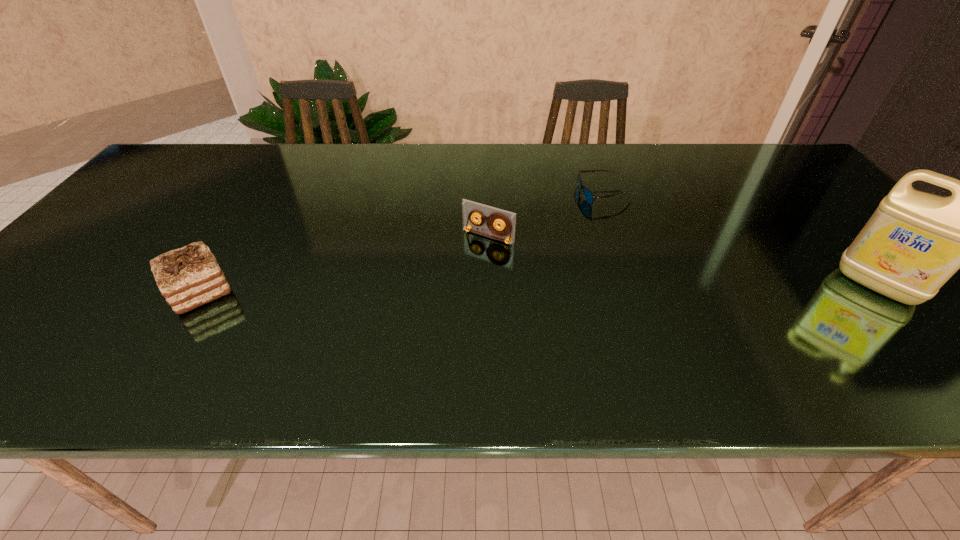
Locate an element on the screen. Image resolution: width=960 pixels, height=540 pixels. free space on the desktop that is between the leftmost object and the tallest object and is positioned at the front of the farthest object showing the lenses is located at coordinates (475, 288).

Identify the location of free spot on the desktop that is between the chocolate cake and the detergent and is positioned at the front of the videotape with visible reels. The height and width of the screenshot is (540, 960). (448, 289).